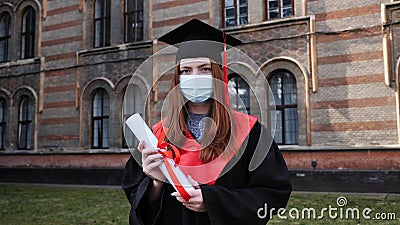
Find the location of a particular element. The image size is (400, 225). lights is located at coordinates (309, 163).